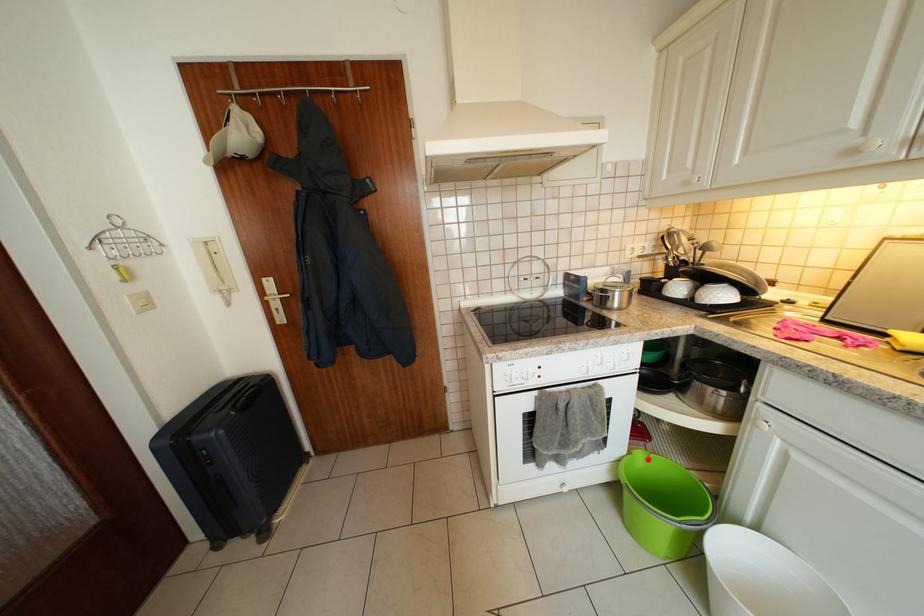
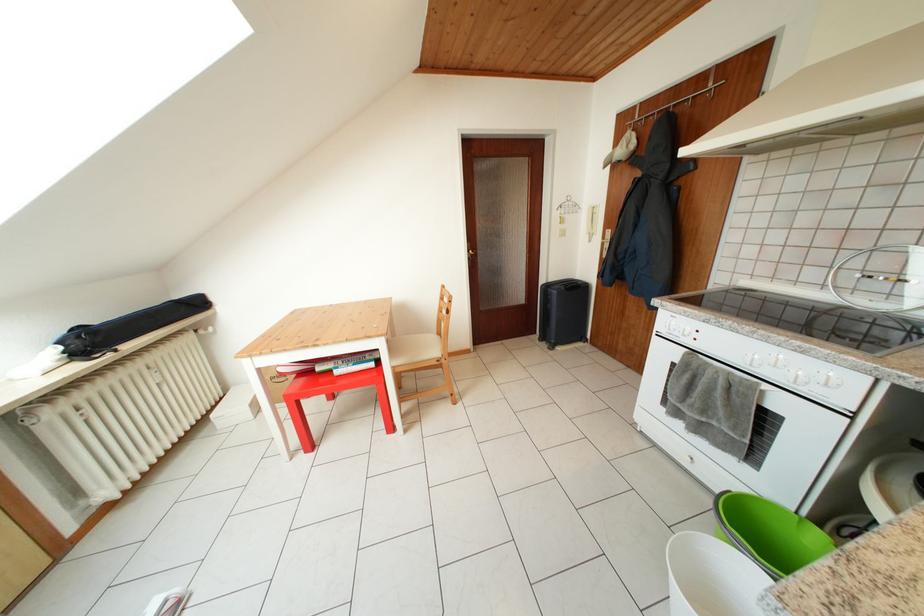
Question: A red point is marked in image1. In image2, is the corresponding 3D point closer to the camera or farther? Reply with the corresponding letter.

Choices:
 (A) The corresponding 3D point is closer.
 (B) The corresponding 3D point is farther.

Answer: (B)